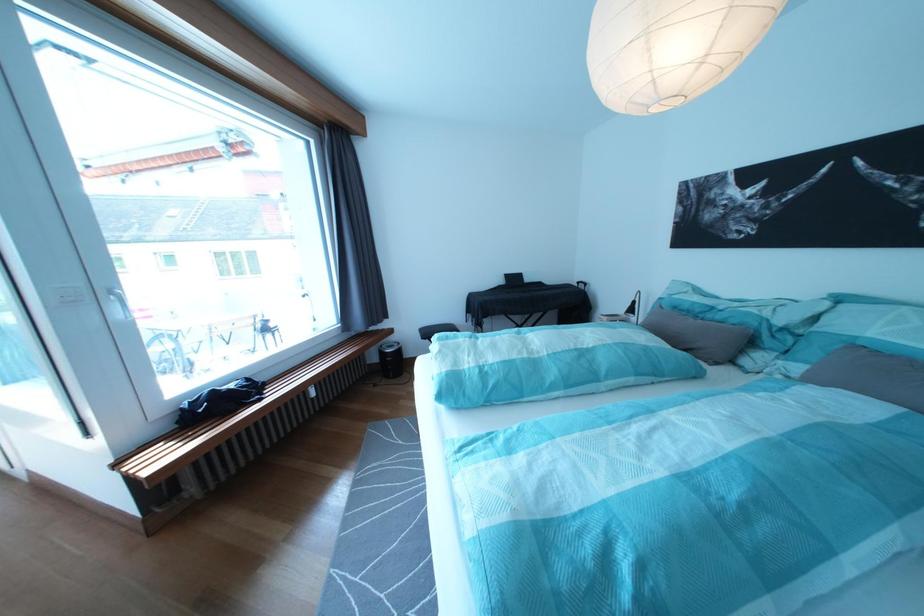
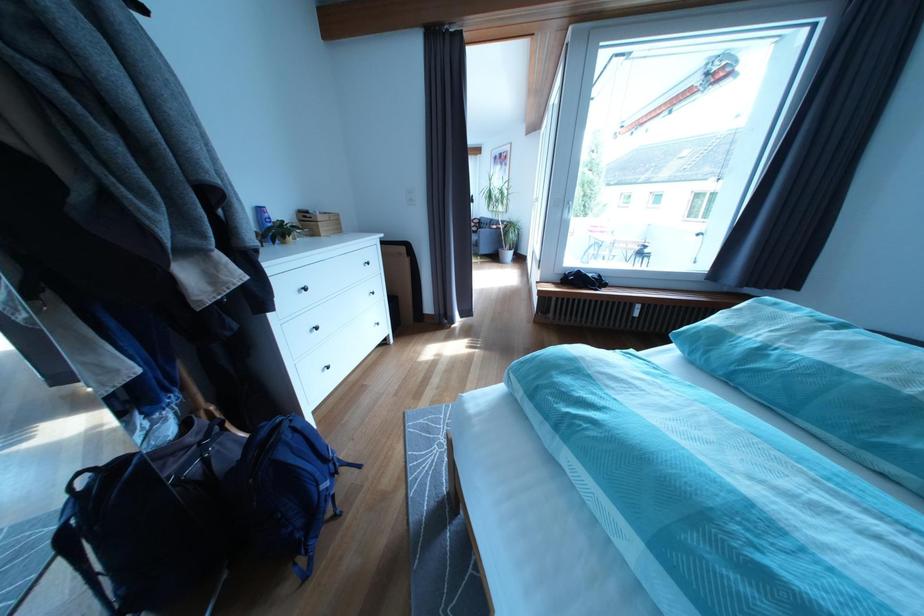
How did the camera likely rotate?

The rotation direction of the camera is left-down.